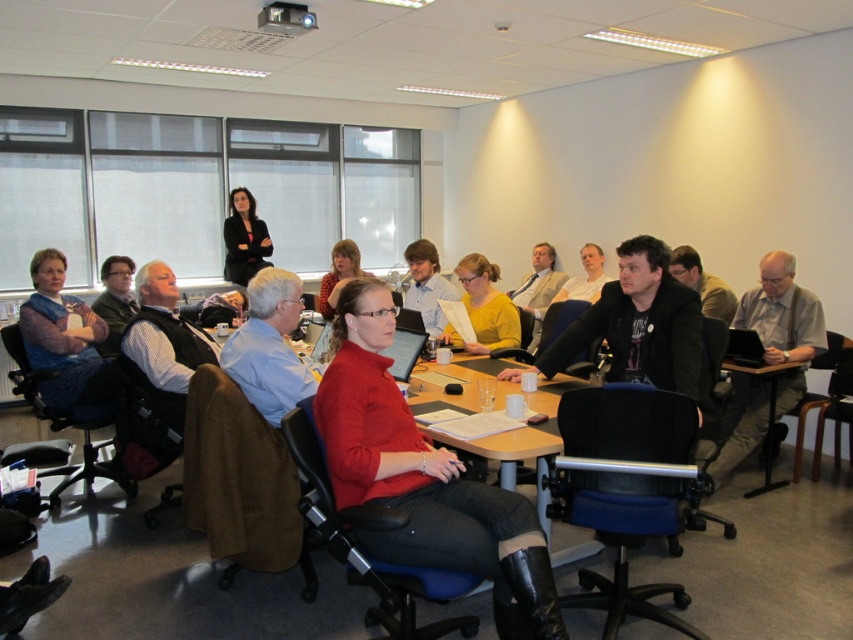
Question: Does knitted sweater at left appear under matte black jacket at center?

Choices:
 (A) yes
 (B) no

Answer: (A)

Question: Which of the following is the farthest from the observer?

Choices:
 (A) matte yellow sweater at center
 (B) matte red shirt at center
 (C) matte red sweater at center

Answer: (A)

Question: Estimate the real-world distances between objects in this image. Which object is closer to the knitted sweater at left?

Choices:
 (A) light blue shirt at center
 (B) blue shirt at center

Answer: (B)

Question: Is light brown leather jacket at center to the left of matte black shirt at center from the viewer's perspective?

Choices:
 (A) no
 (B) yes

Answer: (B)

Question: Which point is farther to the camera?

Choices:
 (A) (538, 266)
 (B) (590, 273)
 (C) (674, 252)
 (D) (57, 358)

Answer: (A)

Question: Can you confirm if matte yellow sweater at center is smaller than matte red shirt at center?

Choices:
 (A) yes
 (B) no

Answer: (A)